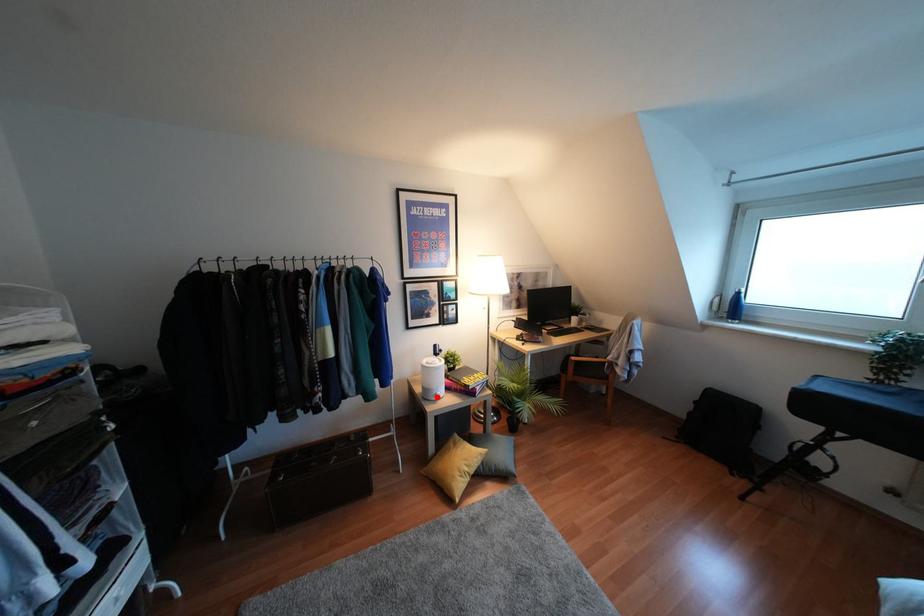
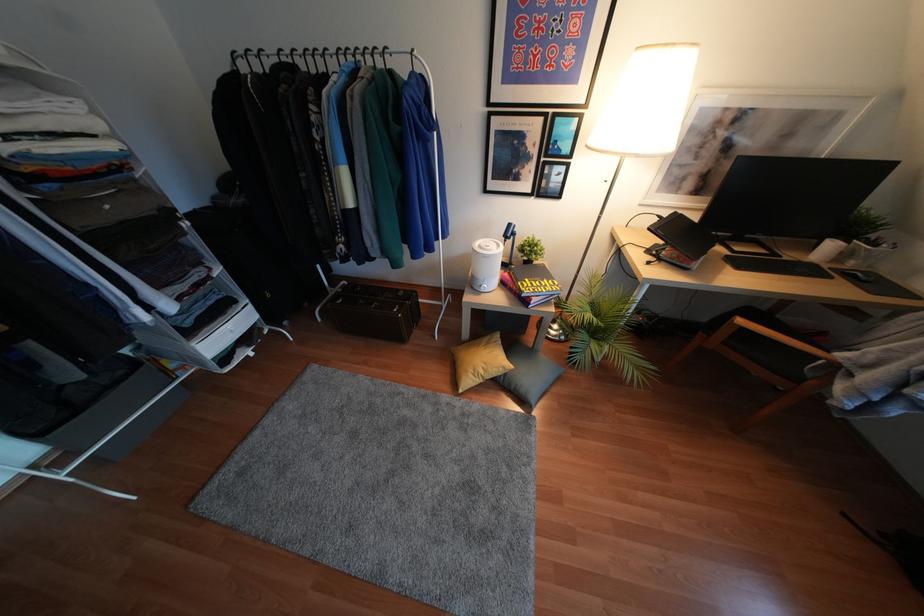
Question: I am providing you with two images of the same scene from different viewpoints. In image1, a red point is highlighted. Considering the same 3D point in image2, which of the following is correct?

Choices:
 (A) It is closer
 (B) It is farther

Answer: (A)